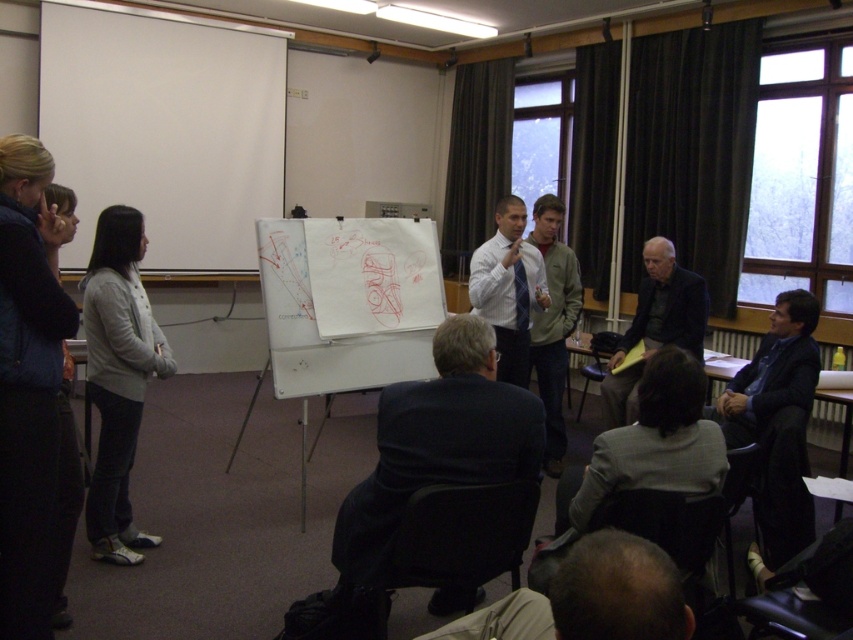
You are standing at the entrance of the classroom and see the dark blue suit at center and the dark brown hair at lower center. Which one is closer to you?

The dark blue suit at center is closer to you because the dark brown hair at lower center is behind it.

You are a photographer standing in the back of the classroom. You want to take a photo of the dark blue suit at center and the dark brown hair at lower center so that both are fully visible in the frame. Based on their heights, which object should you adjust your camera angle to focus on to ensure both are captured without cropping?

The dark blue suit at center is much taller than the dark brown hair at lower center, so you should adjust your camera angle to focus on the dark blue suit at center to ensure both are fully visible without cropping.

You are standing in the classroom facing the whiteboard. There is a point marked at coordinates (349, 301) on the whiteboard. What object is located at that point?

The white matte board at center is represented by point (349, 301).